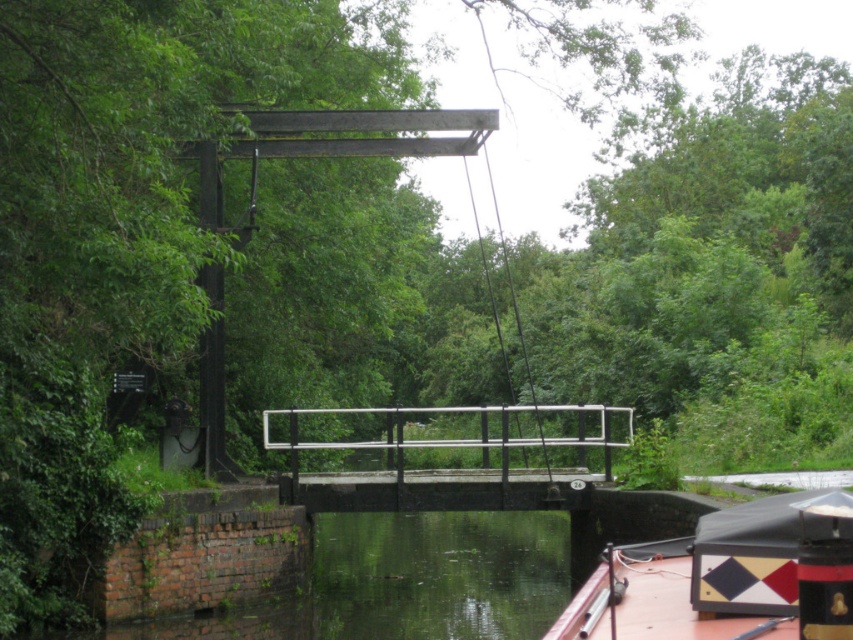
You are navigating a narrowboat through the lock and want to position it between the two points marked on the canal. The first point is at coordinate point (x=381, y=628) and the second is at point (x=596, y=611). Which point should you aim for first to ensure proper alignment with the lock gate?

You should aim for point (x=596, y=611) first because point (x=381, y=628) is behind it. This ensures the narrowboat is aligned correctly with the lock gate by approaching from the front.

In the scene shown: You are a photographer planning to capture the reflection of the green reflective water at lower center and the red plastic boat at lower right in the canal. Which object would have a larger reflection in the photo?

The green reflective water at lower center would have a larger reflection in the photo because it is larger in size than the red plastic boat at lower right.